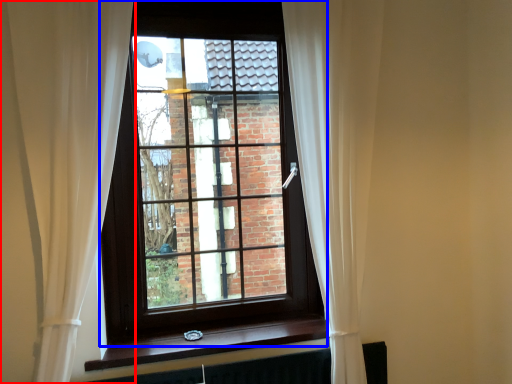
Question: Which of the following is the farthest to the observer, curtain (highlighted by a red box) or window (highlighted by a blue box)?

Choices:
 (A) curtain
 (B) window

Answer: (B)